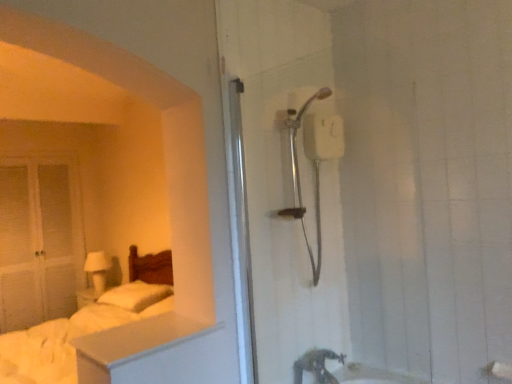
Question: Would you say white soft pillow at left is to the left or to the right of white matte glass door at left in the picture?

Choices:
 (A) left
 (B) right

Answer: (B)

Question: Looking at their shapes, would you say white soft pillow at left is wider or thinner than white matte glass door at left?

Choices:
 (A) thin
 (B) wide

Answer: (B)

Question: Which object is the farthest from the white soft bed at left?

Choices:
 (A) white matte glass door at left
 (B) white matte dresser at lower left
 (C) white matte lampshade at left
 (D) matte silver tap at lower center
 (E) white soft pillow at left

Answer: (D)

Question: Estimate the real-world distances between objects in this image. Which object is farther from the white matte dresser at lower left?

Choices:
 (A) matte silver tap at lower center
 (B) white matte lampshade at left
 (C) white soft pillow at left
 (D) white soft bed at left
 (E) white matte glass door at left

Answer: (E)